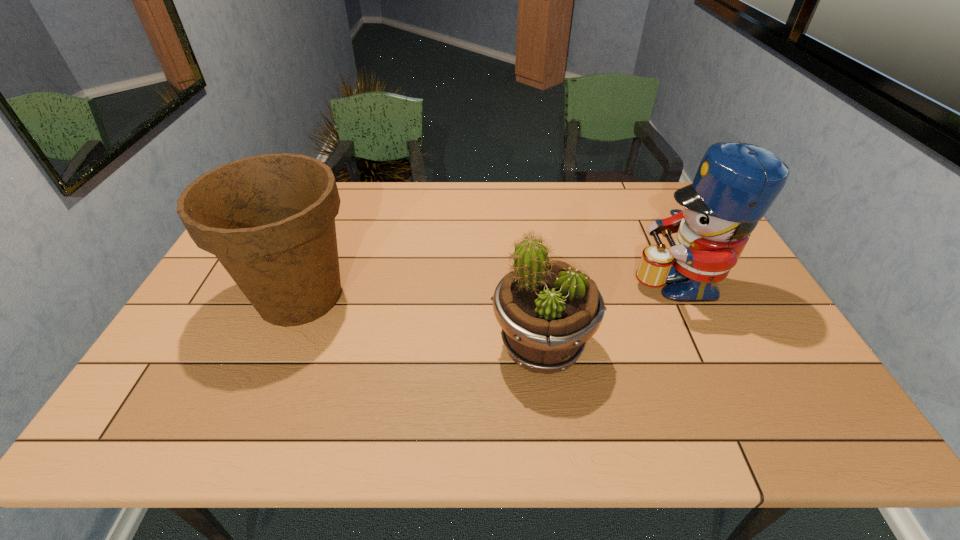
You are a GUI agent. You are given a task and a screenshot of the screen. Output one action in this format:
    pyautogui.click(x=<x>, y=<y>)
    Task: Click on the object at the right edge
    This screenshot has width=960, height=540.
    Given the screenshot: What is the action you would take?
    pyautogui.click(x=736, y=183)

This screenshot has width=960, height=540. Identify the location of free spot at the far edge of the desktop. (621, 191).

Image resolution: width=960 pixels, height=540 pixels. In order to click on vacant space at the left edge of the desktop in this screenshot , I will do `click(219, 266)`.

Where is `free spot at the right edge of the desktop`? free spot at the right edge of the desktop is located at coordinates (735, 364).

Image resolution: width=960 pixels, height=540 pixels. I want to click on vacant space at the far right corner of the desktop, so click(683, 209).

What are the coordinates of `free space that is in between the rightmost object and the second object from right to left` in the screenshot? It's located at (609, 313).

Image resolution: width=960 pixels, height=540 pixels. Find the location of `empty space that is in between the rightmost object and the left flowerpot`. empty space that is in between the rightmost object and the left flowerpot is located at coordinates (488, 288).

Where is `free space between the second object from left to right and the tallest object`? free space between the second object from left to right and the tallest object is located at coordinates (609, 313).

Where is `free area in between the tallest object and the left flowerpot`? The width and height of the screenshot is (960, 540). free area in between the tallest object and the left flowerpot is located at coordinates (488, 288).

Find the location of a particular element. This screenshot has width=960, height=540. vacant space that's between the rightmost object and the left flowerpot is located at coordinates (488, 288).